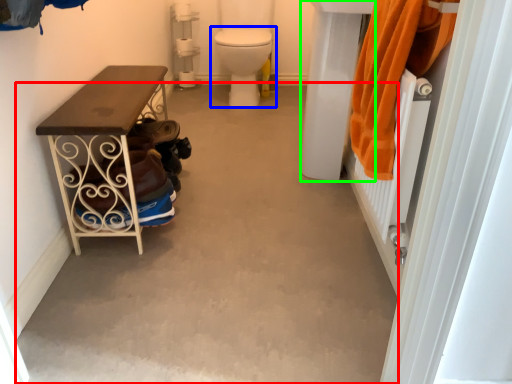
Question: Which object is positioned closest to concrete (highlighted by a red box)? Select from toilet (highlighted by a blue box) and sink (highlighted by a green box).

Choices:
 (A) toilet
 (B) sink

Answer: (B)